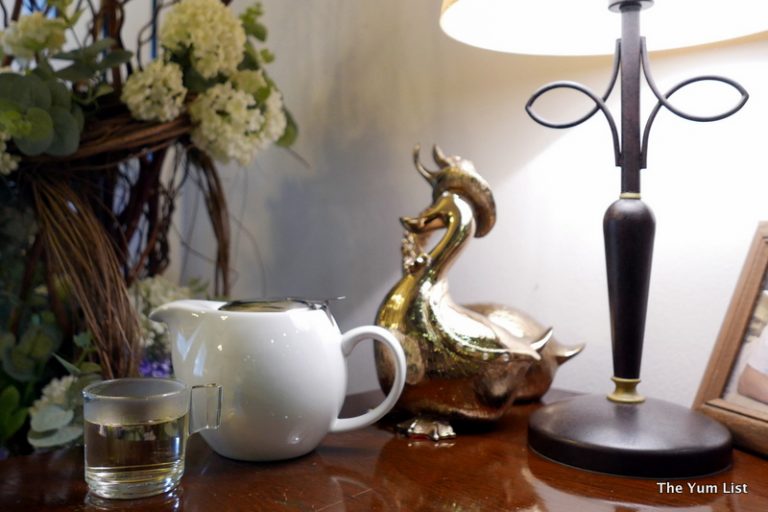
Find the location of a particular element. The height and width of the screenshot is (512, 768). pot is located at coordinates (296, 384).